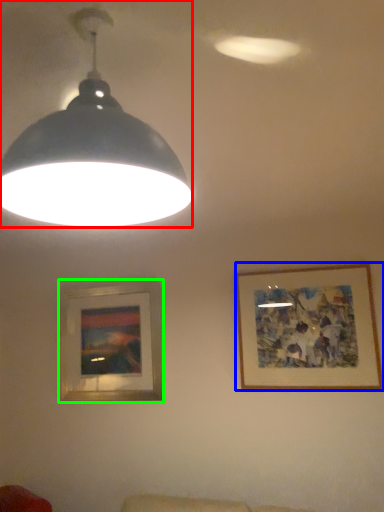
Question: Considering the real-world distances, which object is farthest from lamp (highlighted by a red box)? picture frame (highlighted by a blue box) or picture frame (highlighted by a green box)?

Choices:
 (A) picture frame
 (B) picture frame

Answer: (B)